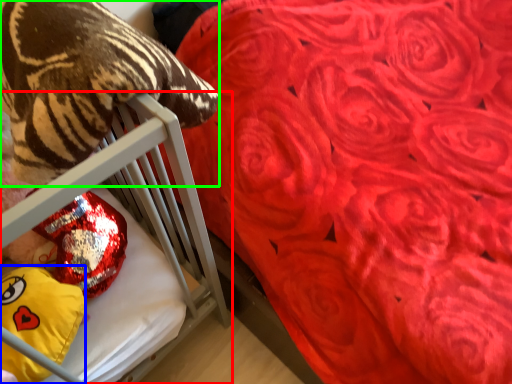
Question: Based on their relative distances, which object is farther from furniture (highlighted by a red box)? Choose from throw pillow (highlighted by a blue box) and animal (highlighted by a green box).

Choices:
 (A) throw pillow
 (B) animal

Answer: (A)